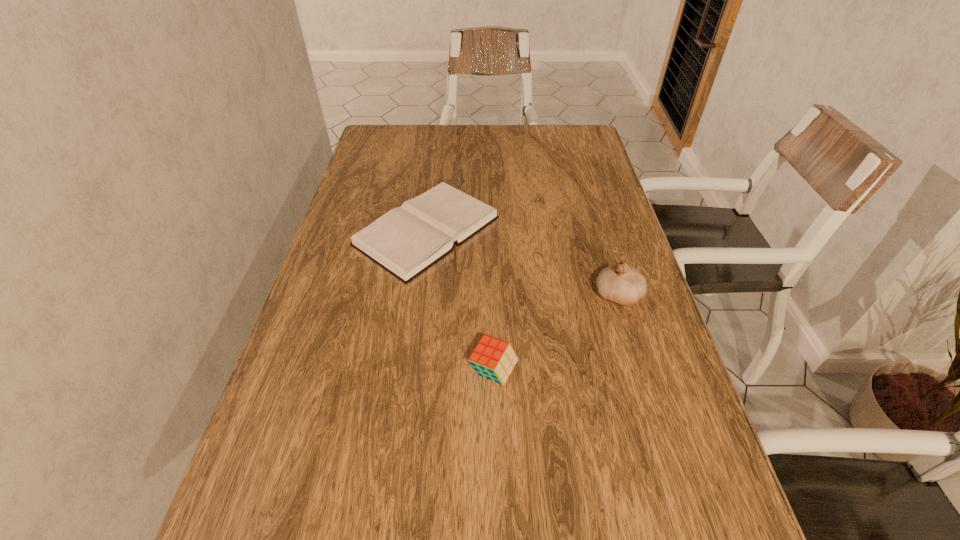
Find the location of a particular element. This screenshot has width=960, height=540. empty space between the cube and the tallest object is located at coordinates (555, 333).

What are the coordinates of `free space between the garlic and the shortest object` in the screenshot? It's located at (522, 262).

Where is `free space between the shortest object and the rightmost object`? The width and height of the screenshot is (960, 540). free space between the shortest object and the rightmost object is located at coordinates (522, 262).

Select which object is the closest to the garlic. Please provide its 2D coordinates. Your answer should be formatted as a tuple, i.e. [(x, y)], where the tuple contains the x and y coordinates of a point satisfying the conditions above.

[(407, 240)]

Identify which object is located as the second nearest to the nearest object. Please provide its 2D coordinates. Your answer should be formatted as a tuple, i.e. [(x, y)], where the tuple contains the x and y coordinates of a point satisfying the conditions above.

[(621, 283)]

Where is `free location that satisfies the following two spatial constraints: 1. on the front side of the second shortest object; 2. on the left side of the hardback book`? The height and width of the screenshot is (540, 960). free location that satisfies the following two spatial constraints: 1. on the front side of the second shortest object; 2. on the left side of the hardback book is located at coordinates (408, 372).

Identify the location of vacant space that satisfies the following two spatial constraints: 1. on the back side of the tallest object; 2. on the left side of the second shortest object. (492, 294).